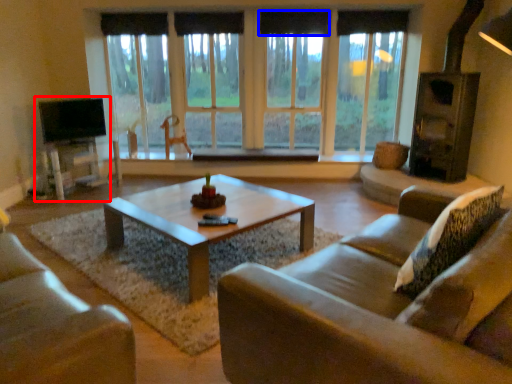
Question: Among these objects, which one is farthest to the camera, entertainment center (highlighted by a red box) or curtain (highlighted by a blue box)?

Choices:
 (A) entertainment center
 (B) curtain

Answer: (B)